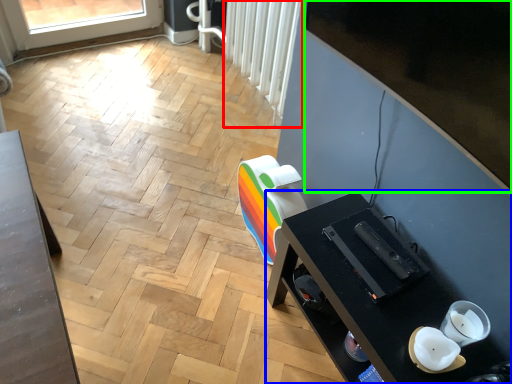
Question: Based on their relative distances, which object is nearer to radiator (highlighted by a red box)? Choose from desk (highlighted by a blue box) and window screen (highlighted by a green box).

Choices:
 (A) desk
 (B) window screen

Answer: (B)